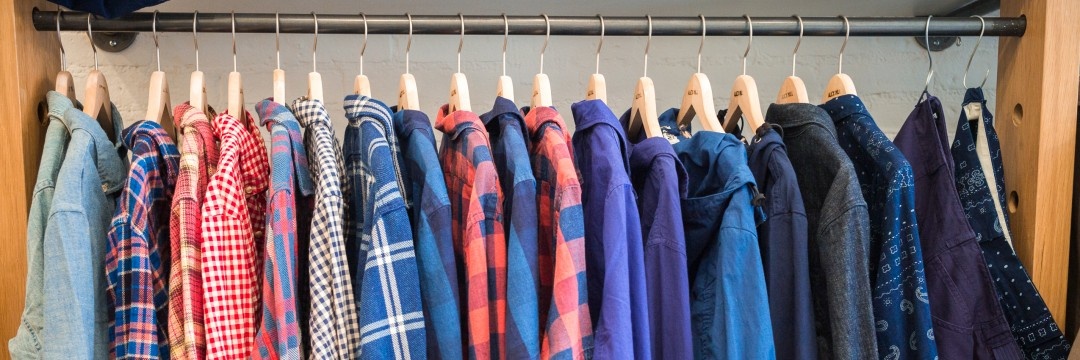
Identify the location of wire on cloth hanger. This screenshot has height=360, width=1080. (846, 37).